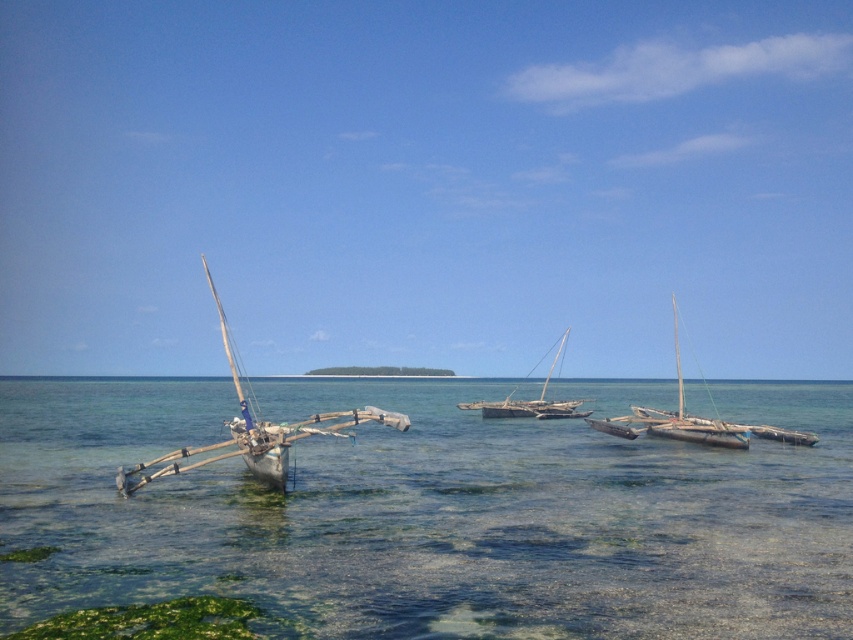
You are a photographer planning to capture a photo of the wooden sailboat at left and the wooden sailboat at center from a position on the shore. Based on their arrangement in the image, which boat should you focus on first to ensure both are in the frame without moving the camera?

The wooden sailboat at left is above the wooden sailboat at center, so you should focus on the wooden sailboat at left first to ensure both are in the frame without moving the camera.

You are standing on the shore looking out at the wooden sailboats anchored in the water. There is a wooden sailboat at left and a wooden sailboat at right. Which boat is closer to the point marked at coordinates [253,429]?

The wooden sailboat at left is located at point [253,429], so it is exactly at that coordinate and therefore the closest to it.